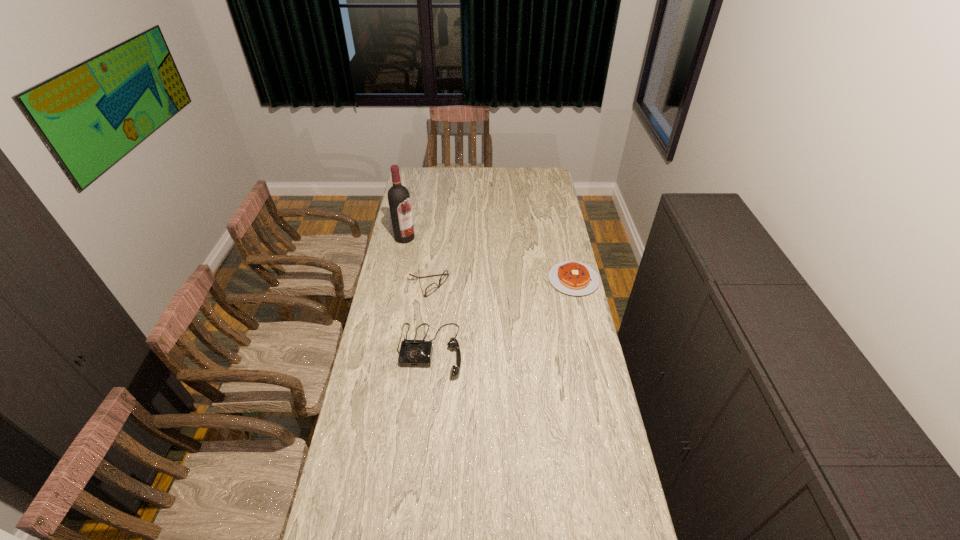
Where is `free space at the right edge of the desktop`? This screenshot has height=540, width=960. free space at the right edge of the desktop is located at coordinates point(555,224).

Where is `vacant space at the far left corner`? The height and width of the screenshot is (540, 960). vacant space at the far left corner is located at coordinates (427, 172).

Identify the location of vacant space at the far right corner of the desktop. This screenshot has height=540, width=960. (528, 171).

Locate an element on the screen. blank area at the near right corner is located at coordinates (585, 524).

At what (x,y) coordinates should I click in order to perform the action: click on vacant space that's between the farthest object and the telephone. Please return your answer as a coordinate pair (x, y). Looking at the image, I should click on (417, 294).

Where is `empty location between the wine bottle and the nearest object`? empty location between the wine bottle and the nearest object is located at coordinates (417, 294).

The height and width of the screenshot is (540, 960). I want to click on free point between the spectacles and the telephone, so click(429, 318).

Identify the location of free point between the second tallest object and the tallest object. (417, 294).

Locate an element on the screen. This screenshot has height=540, width=960. free spot between the pancake and the leftmost object is located at coordinates (489, 259).

Where is `free space between the wine bottle and the rightmost object`? The height and width of the screenshot is (540, 960). free space between the wine bottle and the rightmost object is located at coordinates (489, 259).